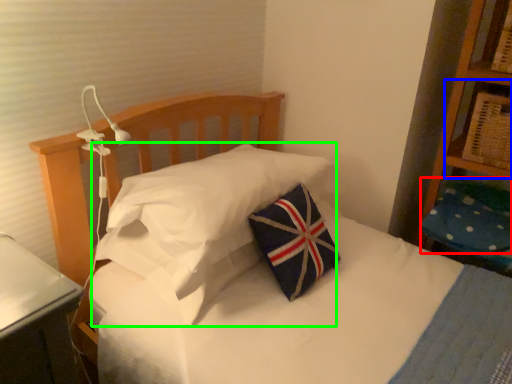
Question: Which is nearer to the pillow (highlighted by a red box)? shelf (highlighted by a blue box) or pillow (highlighted by a green box).

Choices:
 (A) shelf
 (B) pillow

Answer: (A)